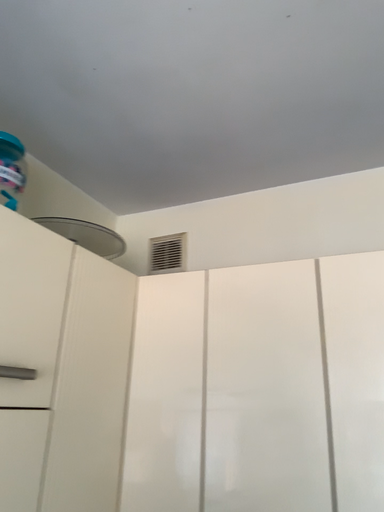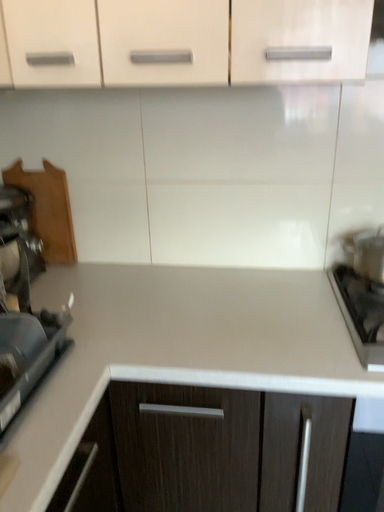
Question: How did the camera likely rotate when shooting the video?

Choices:
 (A) rotated upward
 (B) rotated downward

Answer: (B)